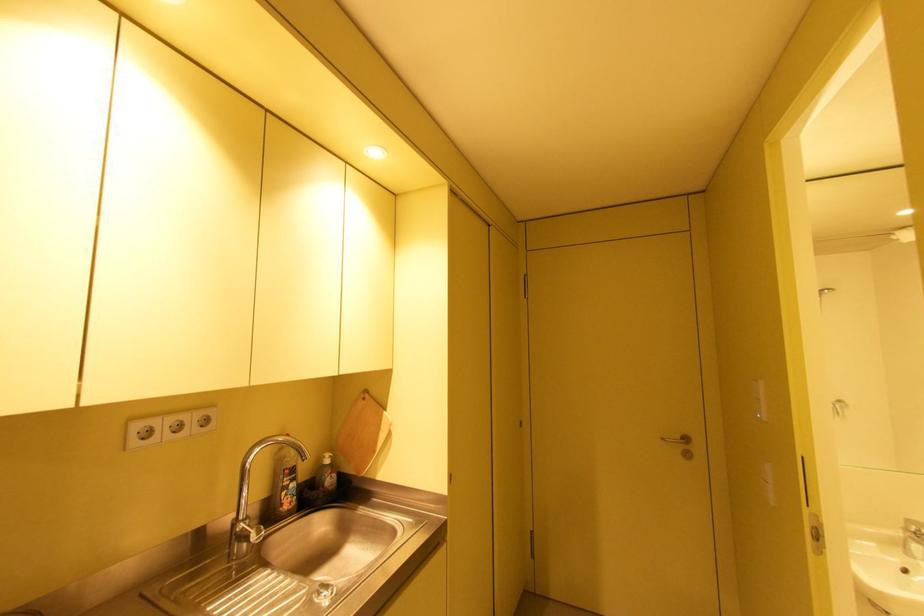
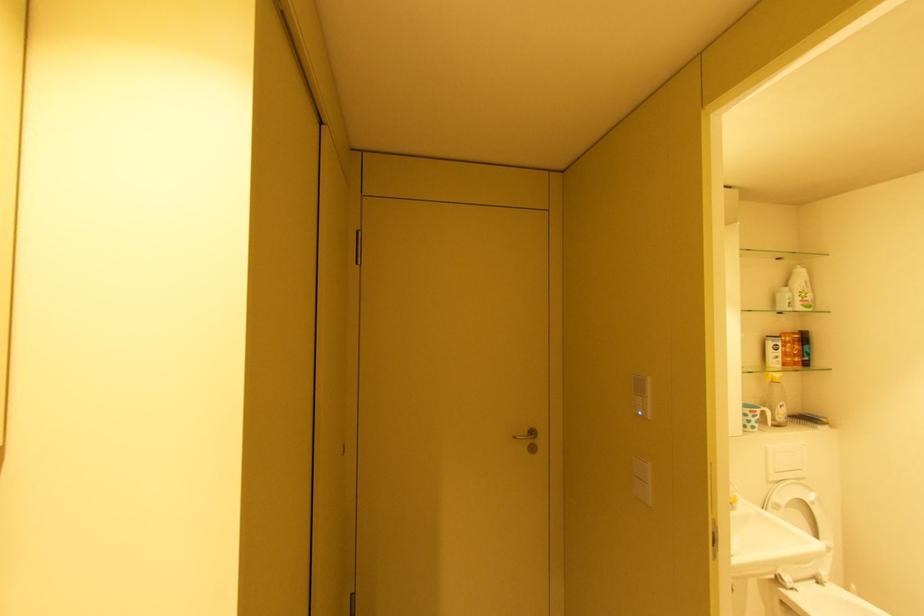
Question: The first image is from the beginning of the video and the second image is from the end. How did the camera likely rotate when shooting the video?

Choices:
 (A) Left
 (B) Right
 (C) Up
 (D) Down

Answer: (B)